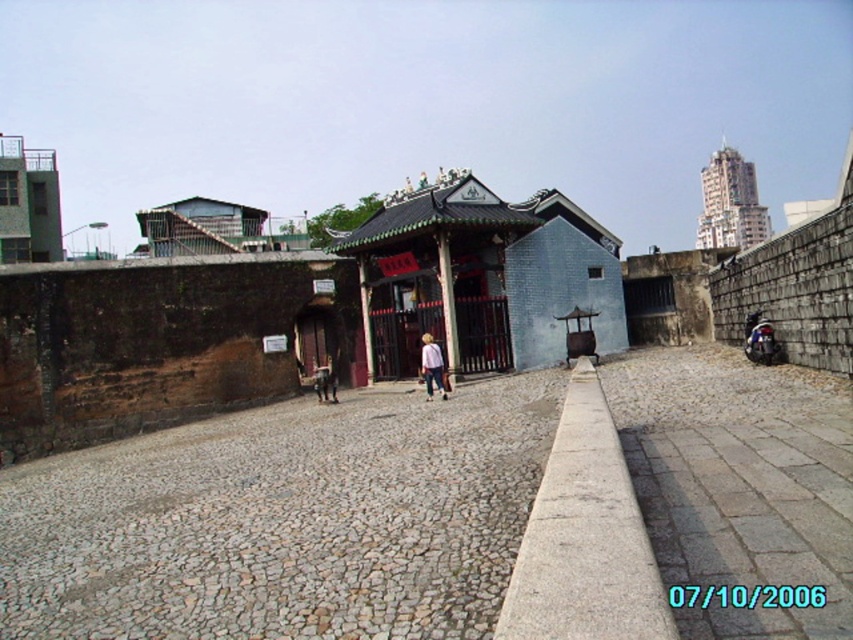
You are a tour guide leading a group through a historical site. You notice a gray cobblestone alley at center and a shiny black motorcycle at right. Can the motorcycle fit through the alley?

The gray cobblestone alley at center is wider than the shiny black motorcycle at right, so the motorcycle can fit through the alley.

You are a tour guide explaining the layout of this historical site to visitors. You mention the gray stone curb at center and the green concrete building at upper left. Which of these two has a greater width?

The green concrete building at upper left has a greater width than the gray stone curb at center.